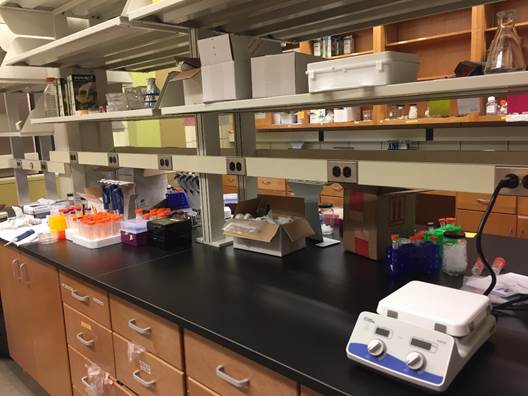
This screenshot has width=528, height=396. In order to click on black counter top in this screenshot , I will do point(209,295).